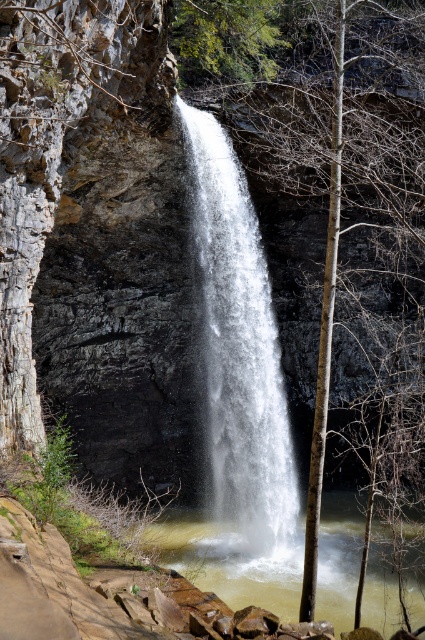
Is point (215, 493) in front of point (277, 609)?

No, it is not.

Where is `white frothy water at center`? The width and height of the screenshot is (425, 640). white frothy water at center is located at coordinates (238, 352).

Can you confirm if bare wood tree at center is positioned to the left of white frothy water at center?

No, bare wood tree at center is not to the left of white frothy water at center.

The height and width of the screenshot is (640, 425). What do you see at coordinates (348, 163) in the screenshot?
I see `bare wood tree at center` at bounding box center [348, 163].

Who is more distant from viewer, (331, 278) or (221, 212)?

The point (221, 212) is more distant.

Identify the location of bare wood tree at center. (348, 163).

Is point (254, 96) positioned before point (379, 572)?

No.

Can you confirm if bare wood tree at center is positioned to the left of clear water at center?

In fact, bare wood tree at center is to the right of clear water at center.

Is point (343, 45) positioned before point (204, 572)?

Yes, point (343, 45) is in front of point (204, 572).

Identify the location of bare wood tree at center. tap(348, 163).